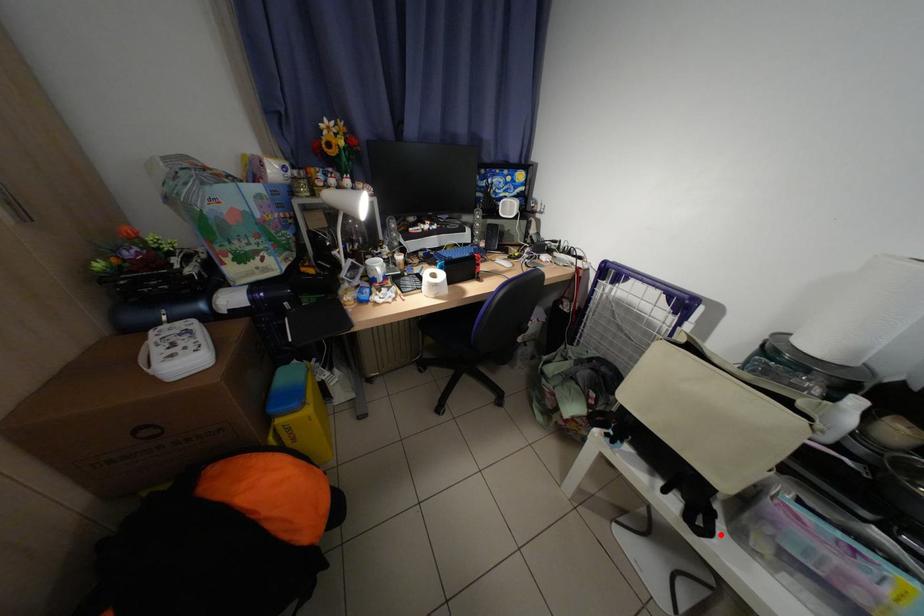
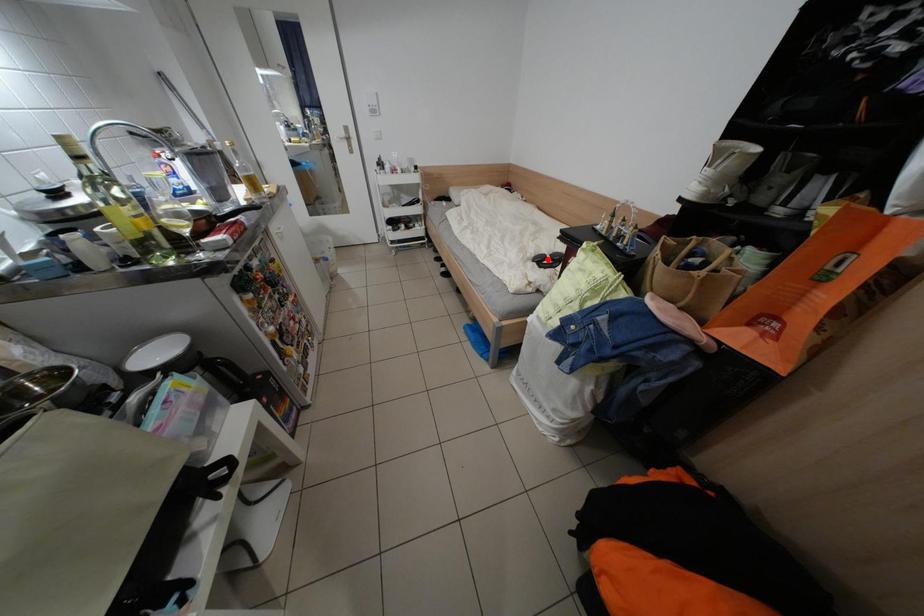
I am providing you with two images of the same scene from different viewpoints. A red point is marked on the first image and another point is marked on the second image. Is the marked point in image1 the same physical position as the marked point in image2?

No